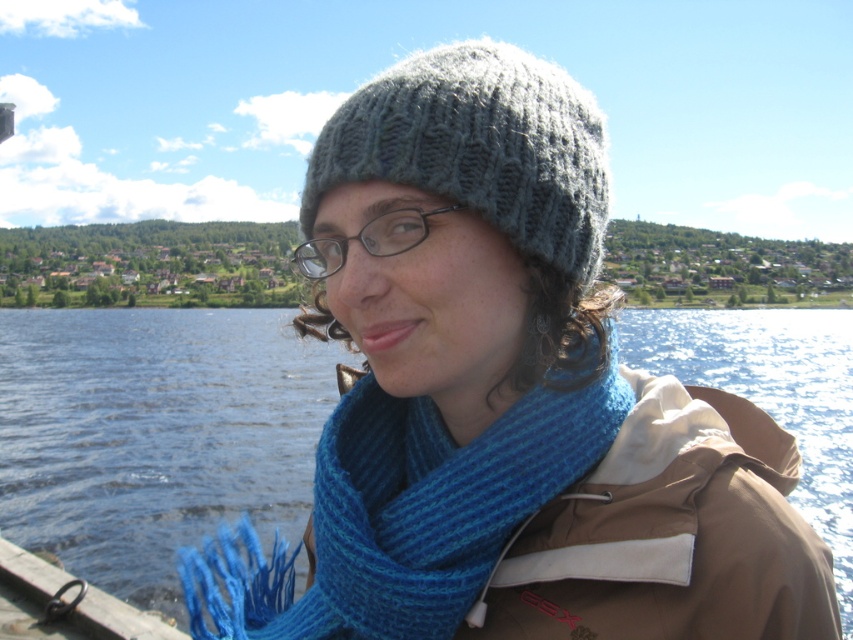
You are standing at the edge of the wooden deck in the image. There are two points marked on the water surface ahead of you. The first point is at coordinates point (733, 547) and the second is at point (596, 145). Which point is nearer to you?

Point (733, 547) is closer to the viewer than point (596, 145).

You are a fashion designer observing a person wearing a blue knitted scarf at center and a knitted gray hat at center. Which item is wider?

The blue knitted scarf at center might be wider than the knitted gray hat at center according to the description.